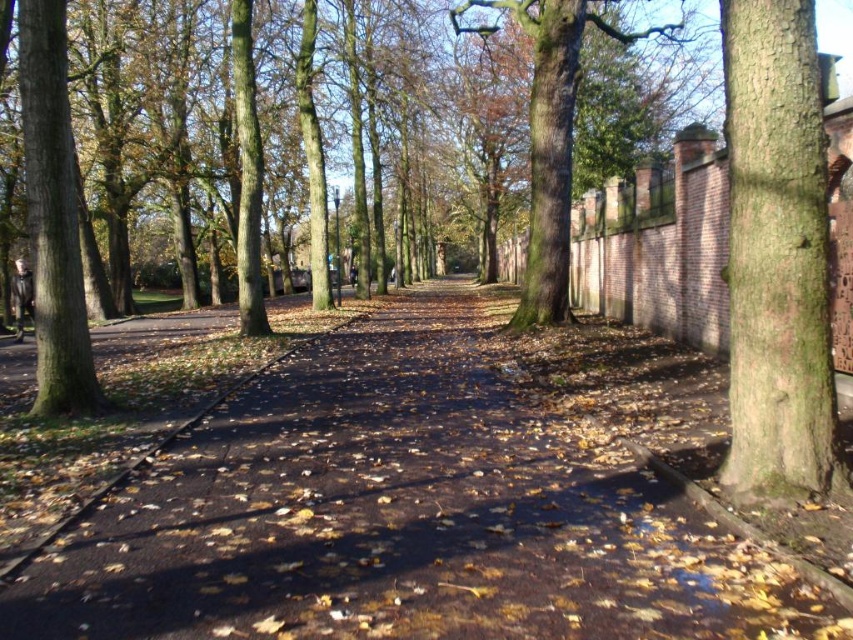
Question: Which object is the farthest from the green rough bark tree at left?

Choices:
 (A) smooth brown bark at right
 (B) brown asphalt pavement at center

Answer: (A)

Question: Is smooth brown bark at right below green rough bark tree at left?

Choices:
 (A) no
 (B) yes

Answer: (B)

Question: Which of the following is the farthest from the observer?

Choices:
 (A) (93, 547)
 (B) (42, 58)
 (C) (795, 401)

Answer: (B)

Question: Which of the following is the farthest from the observer?

Choices:
 (A) (30, 612)
 (B) (729, 476)

Answer: (B)

Question: Can you confirm if brown asphalt pavement at center is positioned to the left of green rough bark tree at left?

Choices:
 (A) no
 (B) yes

Answer: (A)

Question: Does brown asphalt pavement at center have a larger size compared to smooth brown bark at right?

Choices:
 (A) yes
 (B) no

Answer: (A)